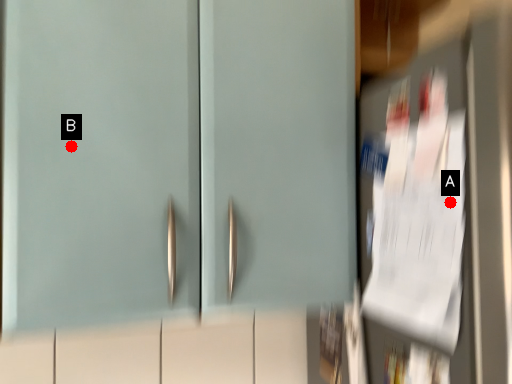
Question: Two points are circled on the image, labeled by A and B beside each circle. Which point appears closest to the camera in this image?

Choices:
 (A) A is closer
 (B) B is closer

Answer: (A)